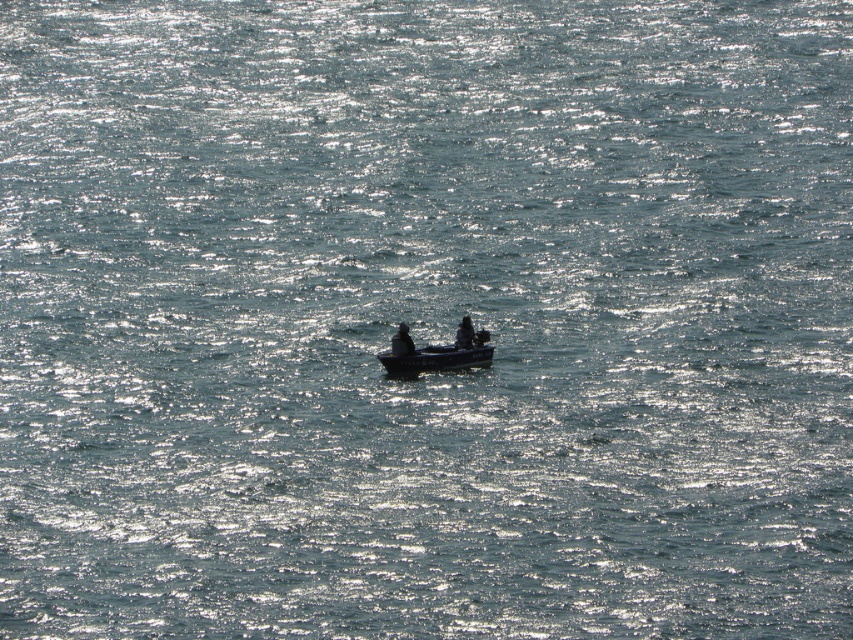
Question: Which point is closer to the camera?

Choices:
 (A) dark gray fabric jacket at center
 (B) smooth dark wood canoe at center

Answer: (B)

Question: Can you confirm if smooth dark wood canoe at center is positioned below dark gray fabric jacket at center?

Choices:
 (A) yes
 (B) no

Answer: (A)

Question: Does dark hair at center have a smaller size compared to dark gray fabric jacket at center?

Choices:
 (A) yes
 (B) no

Answer: (A)

Question: Can you confirm if smooth dark wood canoe at center is bigger than dark hair at center?

Choices:
 (A) no
 (B) yes

Answer: (B)

Question: Among these objects, which one is nearest to the camera?

Choices:
 (A) smooth dark wood canoe at center
 (B) dark hair at center
 (C) dark gray fabric jacket at center

Answer: (A)

Question: Which object is closer to the camera taking this photo?

Choices:
 (A) smooth dark wood canoe at center
 (B) dark hair at center
 (C) dark gray fabric jacket at center

Answer: (A)